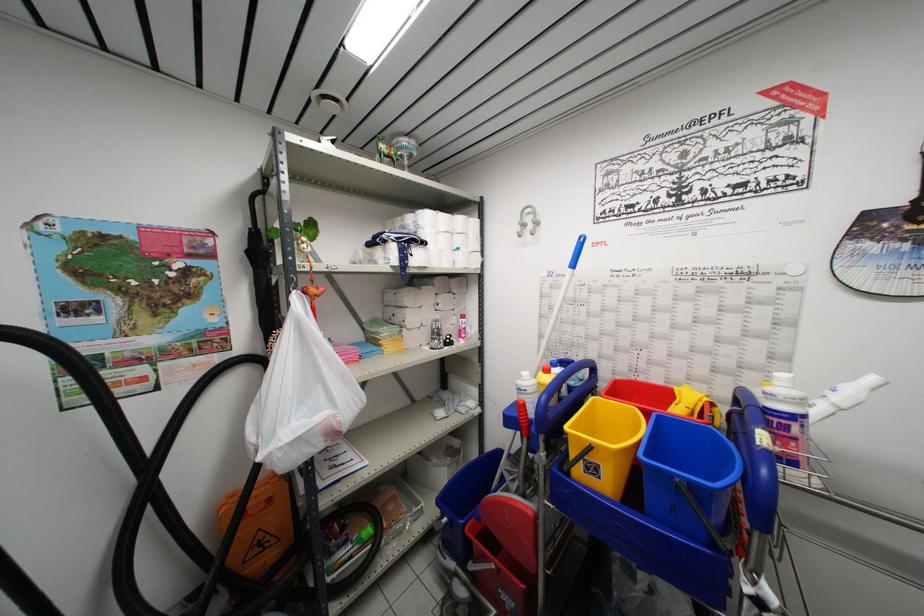
Locate an element on the screen. blue bucket handle is located at coordinates (687, 475).